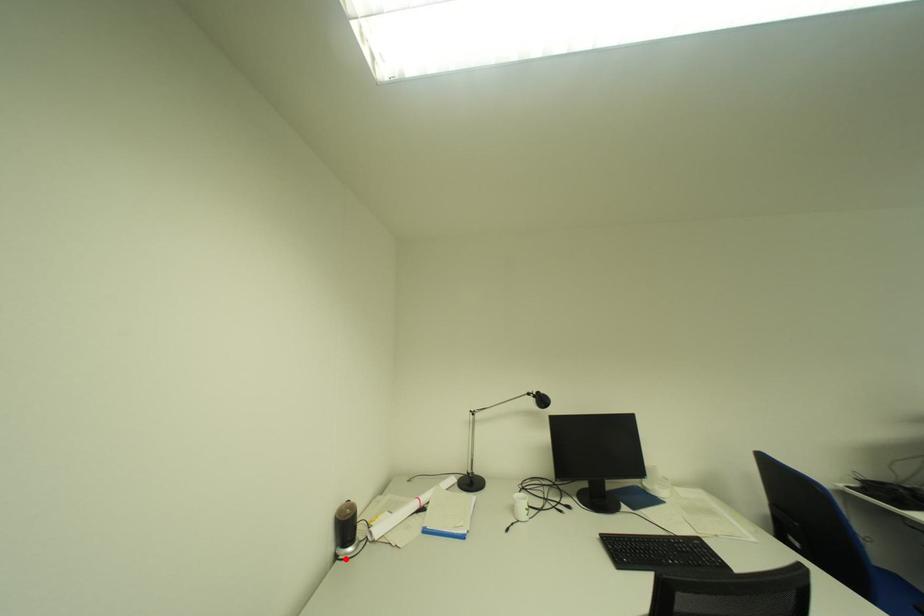
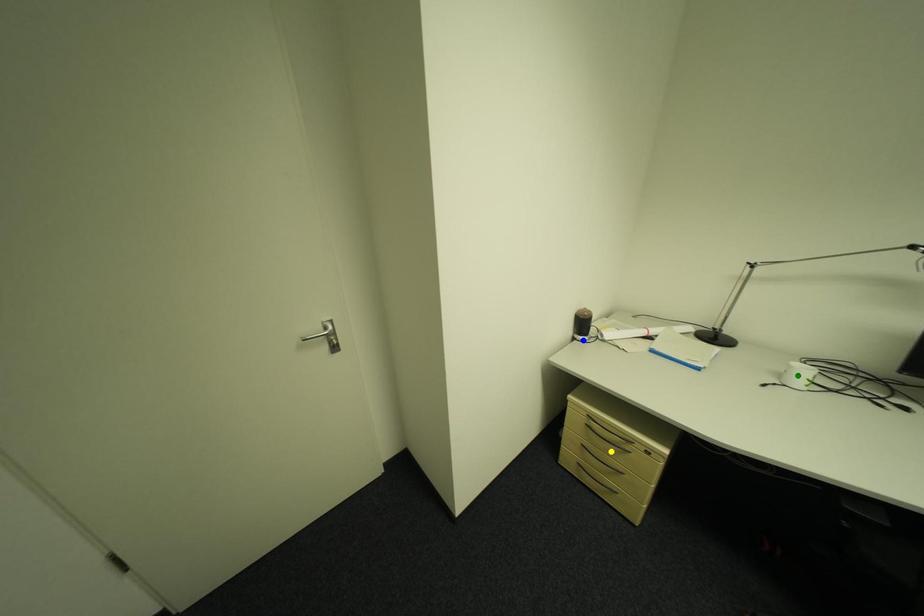
Question: I am providing you with two images of the same scene from different viewpoints. A red point is marked on the first image. You are given multiple points on the second image. Which mark in image 2 goes with the point in image 1?

Choices:
 (A) blue point
 (B) yellow point
 (C) green point

Answer: (A)